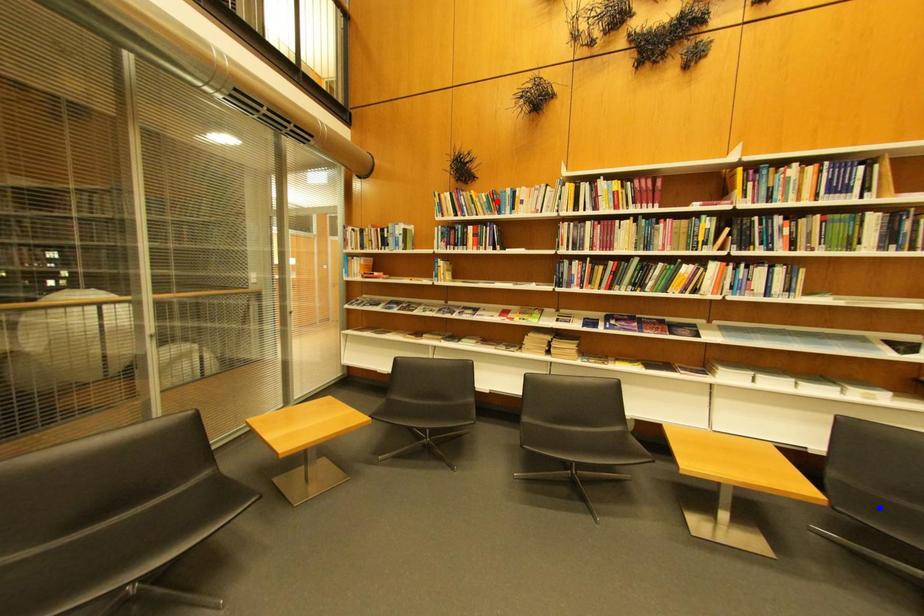
Question: Which of the two points in the image is closer to the camera?

Choices:
 (A) Blue point is closer.
 (B) Red point is closer.

Answer: (A)